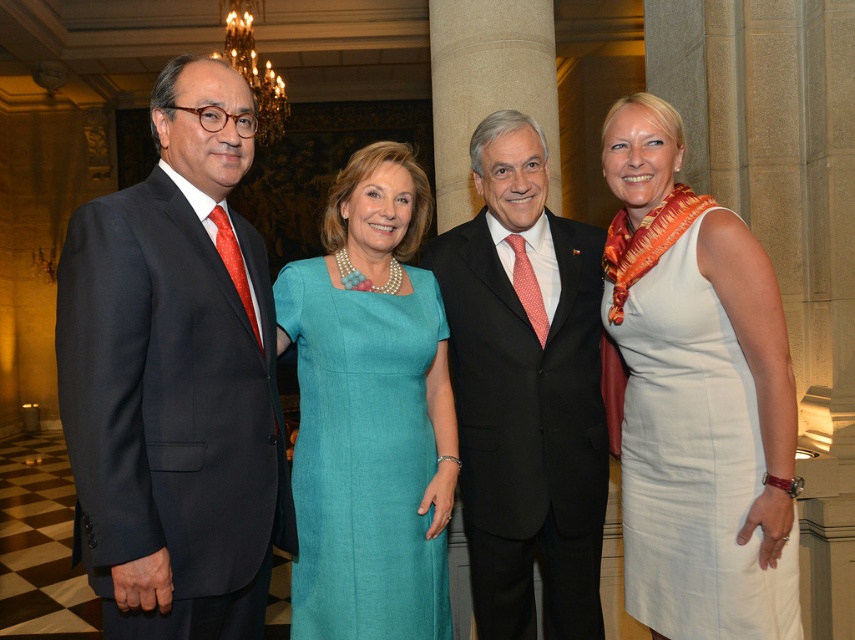
Question: Which object is the closest to the matte black suit at left?

Choices:
 (A) teal fabric dress at center
 (B) white satin dress at right

Answer: (A)

Question: Is matte black suit at left to the left of white satin dress at right from the viewer's perspective?

Choices:
 (A) no
 (B) yes

Answer: (B)

Question: Is matte black suit at left bigger than black suit at center?

Choices:
 (A) yes
 (B) no

Answer: (A)

Question: Which object appears closest to the camera in this image?

Choices:
 (A) matte black suit at left
 (B) white satin dress at right
 (C) black suit at center
 (D) teal fabric dress at center

Answer: (A)

Question: Based on their relative distances, which object is nearer to the teal fabric dress at center?

Choices:
 (A) white satin dress at right
 (B) black suit at center

Answer: (B)

Question: Does black suit at center appear on the right side of teal fabric dress at center?

Choices:
 (A) no
 (B) yes

Answer: (B)